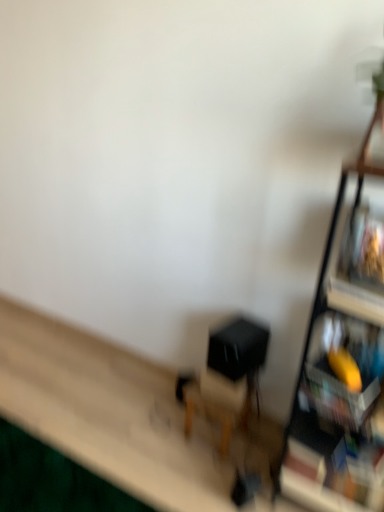
Question: Which is correct: wooden shelf at right is inside matte black swivel chair at center, or outside of it?

Choices:
 (A) outside
 (B) inside

Answer: (A)

Question: Is point click(326, 428) positioned closer to the camera than point click(180, 399)?

Choices:
 (A) closer
 (B) farther

Answer: (A)

Question: Is wooden shelf at right in front of or behind matte black swivel chair at center in the image?

Choices:
 (A) front
 (B) behind

Answer: (A)

Question: From a real-world perspective, is matte black swivel chair at center above or below wooden shelf at right?

Choices:
 (A) below
 (B) above

Answer: (A)

Question: Considering the positions of matte black swivel chair at center and wooden shelf at right in the image, is matte black swivel chair at center wider or thinner than wooden shelf at right?

Choices:
 (A) wide
 (B) thin

Answer: (B)

Question: Based on their sizes in the image, would you say matte black swivel chair at center is bigger or smaller than wooden shelf at right?

Choices:
 (A) big
 (B) small

Answer: (B)

Question: Is point (192, 418) positioned closer to the camera than point (327, 352)?

Choices:
 (A) closer
 (B) farther

Answer: (B)